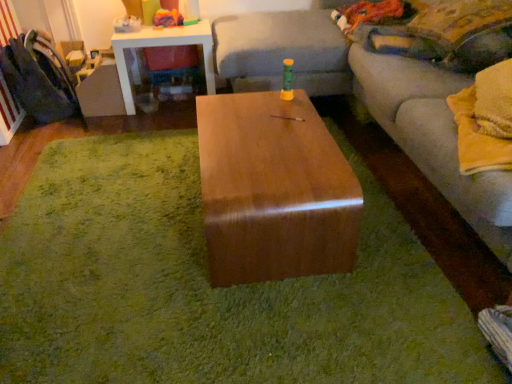
Image resolution: width=512 pixels, height=384 pixels. Find the location of `blank space situated above brown glossy wood table at center (from a real-world perspective)`. blank space situated above brown glossy wood table at center (from a real-world perspective) is located at coordinates (173, 251).